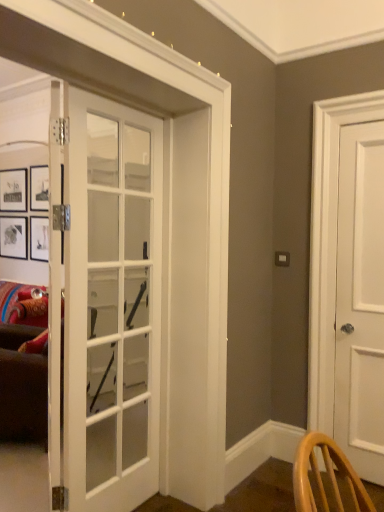
What is the approximate height of white glass door at center, which is the 1th door from left to right?

white glass door at center, which is the 1th door from left to right, is 6.50 feet in height.

What is the approximate width of white glass door at center, positioned as the 2th door in back-to-front order?

white glass door at center, positioned as the 2th door in back-to-front order, is 4.46 centimeters in width.

At what (x,y) coordinates should I click in order to perform the action: click on white glass door at center, which is the second door from right to left. Please return your answer as a coordinate pair (x, y). Image resolution: width=384 pixels, height=512 pixels. Looking at the image, I should click on (105, 303).

What do you see at coordinates (105, 303) in the screenshot? I see `white glass door at center, the first door viewed from the front` at bounding box center [105, 303].

The image size is (384, 512). Find the location of `white matte door at right, placed as the 1th door when sorted from back to front`. white matte door at right, placed as the 1th door when sorted from back to front is located at coordinates (360, 300).

The image size is (384, 512). Describe the element at coordinates (360, 300) in the screenshot. I see `white matte door at right, which is the second door in front-to-back order` at that location.

In the scene shown: What is the approximate height of white matte door at right, placed as the 1th door when sorted from back to front?

white matte door at right, placed as the 1th door when sorted from back to front, is 2.01 meters in height.

The image size is (384, 512). What are the coordinates of `white glass door at center, which is the 1th door from left to right` in the screenshot? It's located at (105, 303).

Does white glass door at center, positioned as the 2th door in back-to-front order, appear on the right side of white matte door at right, the 1th door from the right?

In fact, white glass door at center, positioned as the 2th door in back-to-front order, is to the left of white matte door at right, the 1th door from the right.

Which is behind, white glass door at center, the first door viewed from the front, or white matte door at right, placed as the 1th door when sorted from back to front?

Positioned behind is white matte door at right, placed as the 1th door when sorted from back to front.

Is point (134, 295) positioned before point (367, 208)?

No, it is behind (367, 208).

From the image's perspective, between white glass door at center, positioned as the 2th door in back-to-front order, and white matte door at right, the 2th door in the left-to-right sequence, which one is located above?

white matte door at right, the 2th door in the left-to-right sequence, appears higher in the image.

From a real-world perspective, between white glass door at center, the first door viewed from the front, and white matte door at right, which is the second door in front-to-back order, who is vertically higher?

In real-world perspective, white matte door at right, which is the second door in front-to-back order, is above.

Considering the sizes of objects white glass door at center, which is the second door from right to left, and white matte door at right, the 1th door from the right, in the image provided, who is wider, white glass door at center, which is the second door from right to left, or white matte door at right, the 1th door from the right,?

Wider between the two is white matte door at right, the 1th door from the right.

Which of these two, white glass door at center, which is the 1th door from left to right, or white matte door at right, placed as the 1th door when sorted from back to front, stands taller?

white matte door at right, placed as the 1th door when sorted from back to front.

Consider the image. Can you confirm if white glass door at center, which is the 1th door from left to right, is smaller than white matte door at right, the 2th door in the left-to-right sequence?

No.

Is white glass door at center, positioned as the 2th door in back-to-front order, surrounding white matte door at right, placed as the 1th door when sorted from back to front?

No, white matte door at right, placed as the 1th door when sorted from back to front, is not inside white glass door at center, positioned as the 2th door in back-to-front order.

Does white glass door at center, positioned as the 2th door in back-to-front order, touch white matte door at right, which is the second door in front-to-back order?

No, white glass door at center, positioned as the 2th door in back-to-front order, is not touching white matte door at right, which is the second door in front-to-back order.

Is white glass door at center, the first door viewed from the front, looking in the opposite direction of white matte door at right, the 1th door from the right?

No, white glass door at center, the first door viewed from the front, is not facing the opposite direction of white matte door at right, the 1th door from the right.

How many degrees apart are the facing directions of white glass door at center, positioned as the 2th door in back-to-front order, and white matte door at right, the 2th door in the left-to-right sequence?

The angular difference between white glass door at center, positioned as the 2th door in back-to-front order, and white matte door at right, the 2th door in the left-to-right sequence, is 91.3 degrees.

Image resolution: width=384 pixels, height=512 pixels. In order to click on door below the white matte door at right, the 1th door from the right (from a real-world perspective) in this screenshot , I will do `click(105, 303)`.

Between white matte door at right, placed as the 1th door when sorted from back to front, and white glass door at center, which is the 1th door from left to right, which one appears on the right side from the viewer's perspective?

white matte door at right, placed as the 1th door when sorted from back to front.

Considering the positions of objects white matte door at right, which is the second door in front-to-back order, and white glass door at center, which is the second door from right to left, in the image provided, who is in front, white matte door at right, which is the second door in front-to-back order, or white glass door at center, which is the second door from right to left,?

white glass door at center, which is the second door from right to left.

Is point (355, 362) closer to viewer compared to point (157, 274)?

No, it is not.

From the image's perspective, is white matte door at right, placed as the 1th door when sorted from back to front, above or below white glass door at center, which is the 1th door from left to right?

white matte door at right, placed as the 1th door when sorted from back to front, is situated higher than white glass door at center, which is the 1th door from left to right, in the image.

From a real-world perspective, is white matte door at right, the 1th door from the right, on top of white glass door at center, positioned as the 2th door in back-to-front order?

Indeed, from a real-world perspective, white matte door at right, the 1th door from the right, stands above white glass door at center, positioned as the 2th door in back-to-front order.

Is white matte door at right, the 2th door in the left-to-right sequence, wider than white glass door at center, the first door viewed from the front?

Correct, the width of white matte door at right, the 2th door in the left-to-right sequence, exceeds that of white glass door at center, the first door viewed from the front.

Does white matte door at right, placed as the 1th door when sorted from back to front, have a greater height compared to white glass door at center, which is the second door from right to left?

Correct, white matte door at right, placed as the 1th door when sorted from back to front, is much taller as white glass door at center, which is the second door from right to left.

Considering the relative sizes of white matte door at right, the 2th door in the left-to-right sequence, and white glass door at center, positioned as the 2th door in back-to-front order, in the image provided, is white matte door at right, the 2th door in the left-to-right sequence, bigger than white glass door at center, positioned as the 2th door in back-to-front order,?

No.

Is white matte door at right, placed as the 1th door when sorted from back to front, completely or partially outside of white glass door at center, which is the second door from right to left?

Yes, white matte door at right, placed as the 1th door when sorted from back to front, is outside of white glass door at center, which is the second door from right to left.

Is white matte door at right, placed as the 1th door when sorted from back to front, far away from white glass door at center, which is the second door from right to left?

Indeed, white matte door at right, placed as the 1th door when sorted from back to front, is not near white glass door at center, which is the second door from right to left.

In the scene shown: Is white matte door at right, which is the second door in front-to-back order, looking in the opposite direction of white glass door at center, which is the 1th door from left to right?

white matte door at right, which is the second door in front-to-back order, is not turned away from white glass door at center, which is the 1th door from left to right.

The image size is (384, 512). In order to click on door located on the right of white glass door at center, the first door viewed from the front in this screenshot , I will do `click(360, 300)`.

At what (x,y) coordinates should I click in order to perform the action: click on door in front of the white matte door at right, which is the second door in front-to-back order. Please return your answer as a coordinate pair (x, y). Looking at the image, I should click on (105, 303).

This screenshot has width=384, height=512. I want to click on door on the left of white matte door at right, the 1th door from the right, so click(x=105, y=303).